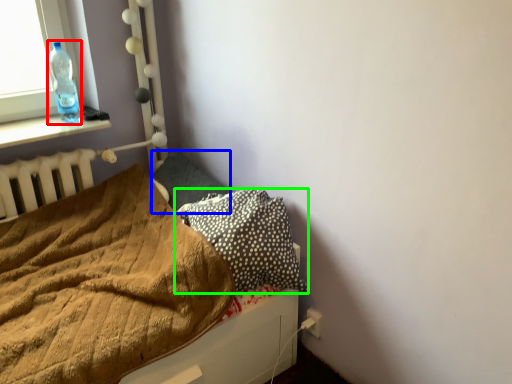
Question: Which is nearer to the bottle (highlighted by a red box)? pillow (highlighted by a blue box) or pillow (highlighted by a green box).

Choices:
 (A) pillow
 (B) pillow

Answer: (A)